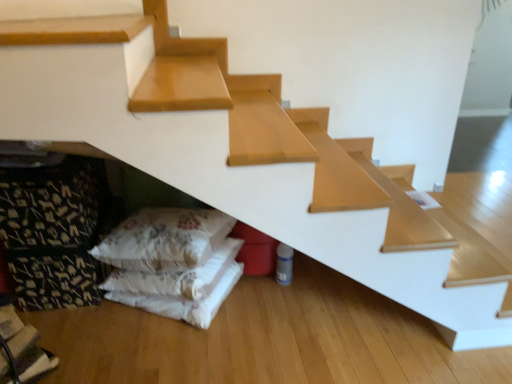
Question: Is white fabric pillows at lower left aimed at fluffy white pillow at lower left?

Choices:
 (A) yes
 (B) no

Answer: (B)

Question: From the image's perspective, is white fabric pillows at lower left above fluffy white pillow at lower left?

Choices:
 (A) no
 (B) yes

Answer: (A)

Question: Does white fabric pillows at lower left have a lesser height compared to fluffy white pillow at lower left?

Choices:
 (A) no
 (B) yes

Answer: (B)

Question: From the image's perspective, does white fabric pillows at lower left appear lower than fluffy white pillow at lower left?

Choices:
 (A) yes
 (B) no

Answer: (A)

Question: Is white fabric pillows at lower left taller than fluffy white pillow at lower left?

Choices:
 (A) yes
 (B) no

Answer: (B)

Question: From a real-world perspective, is white fabric pillows at lower left positioned over fluffy white pillow at lower left based on gravity?

Choices:
 (A) no
 (B) yes

Answer: (A)

Question: Does fluffy white pillow at lower left contain white fabric pillows at lower left?

Choices:
 (A) yes
 (B) no

Answer: (B)

Question: Considering the relative sizes of fluffy white pillow at lower left and white fabric pillows at lower left in the image provided, is fluffy white pillow at lower left bigger than white fabric pillows at lower left?

Choices:
 (A) yes
 (B) no

Answer: (A)

Question: Considering the relative sizes of fluffy white pillow at lower left and white fabric pillows at lower left in the image provided, is fluffy white pillow at lower left thinner than white fabric pillows at lower left?

Choices:
 (A) yes
 (B) no

Answer: (A)

Question: From the image's perspective, does fluffy white pillow at lower left appear higher than white fabric pillows at lower left?

Choices:
 (A) yes
 (B) no

Answer: (A)

Question: Does fluffy white pillow at lower left touch white fabric pillows at lower left?

Choices:
 (A) no
 (B) yes

Answer: (A)

Question: Is fluffy white pillow at lower left to the right of white fabric pillows at lower left from the viewer's perspective?

Choices:
 (A) yes
 (B) no

Answer: (A)

Question: From the image's perspective, is white fabric pillows at lower left located above or below fluffy white pillow at lower left?

Choices:
 (A) above
 (B) below

Answer: (B)